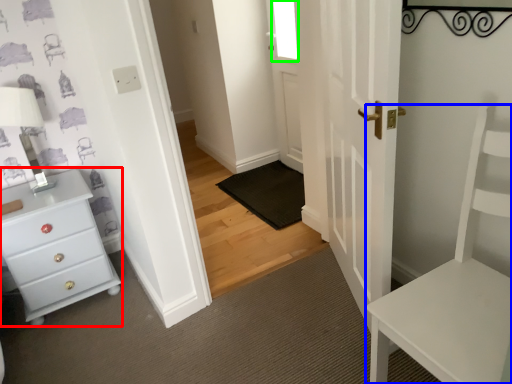
Question: Based on their relative distances, which object is nearer to chest of drawers (highlighted by a red box)? Choose from furniture (highlighted by a blue box) and window (highlighted by a green box).

Choices:
 (A) furniture
 (B) window

Answer: (A)